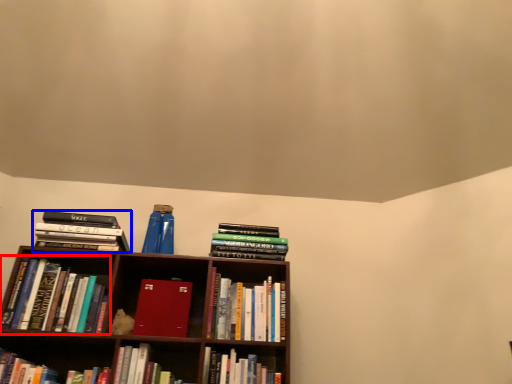
Question: Which object is further to the camera taking this photo, book (highlighted by a red box) or book (highlighted by a blue box)?

Choices:
 (A) book
 (B) book

Answer: (B)